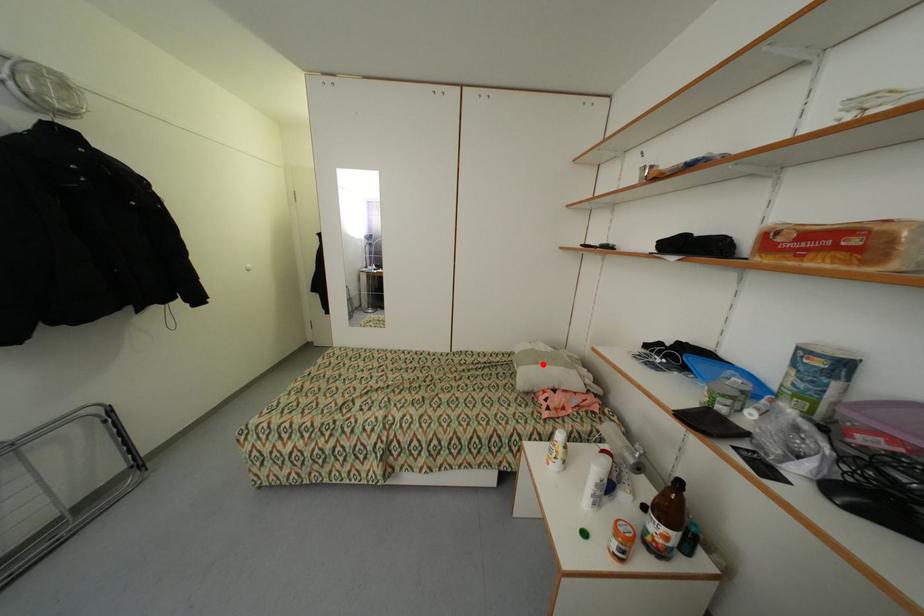
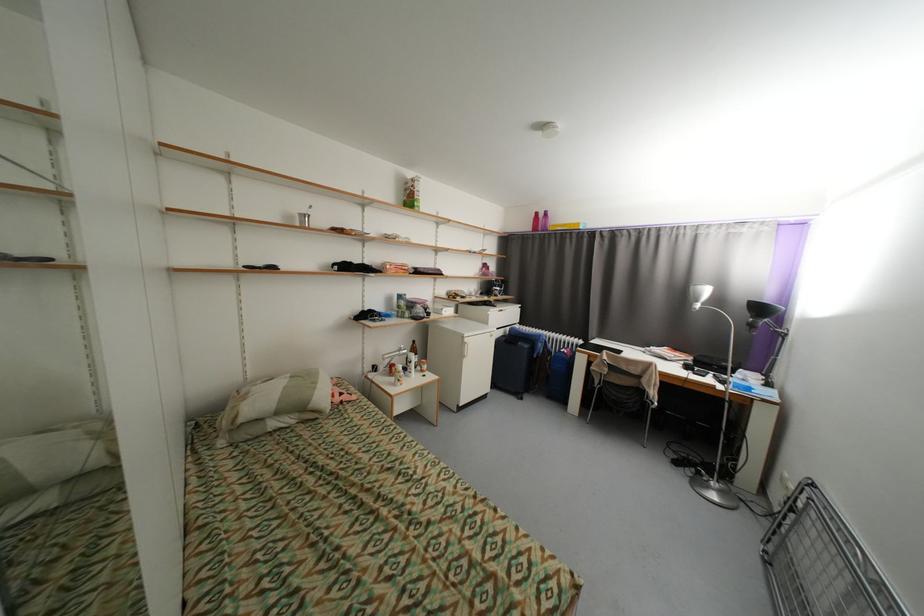
In the second image, find the point that corresponds to the highlighted location in the first image.

(322, 384)